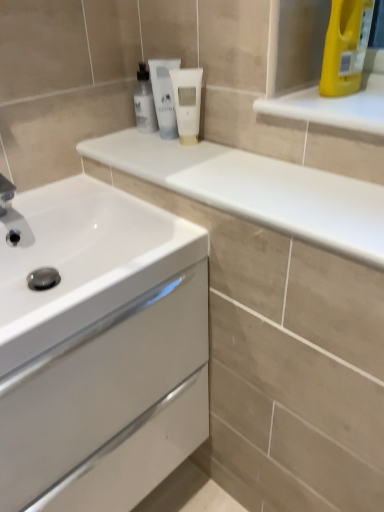
You are a GUI agent. You are given a task and a screenshot of the screen. Output one action in this format:
    pyautogui.click(x=<x>, y=<y>)
    Task: Click on the free region on the left part of white matte tube at center, marked as the third mouthwash in a left-to-right arrangement
    The height and width of the screenshot is (512, 384).
    Given the screenshot: What is the action you would take?
    pyautogui.click(x=132, y=145)